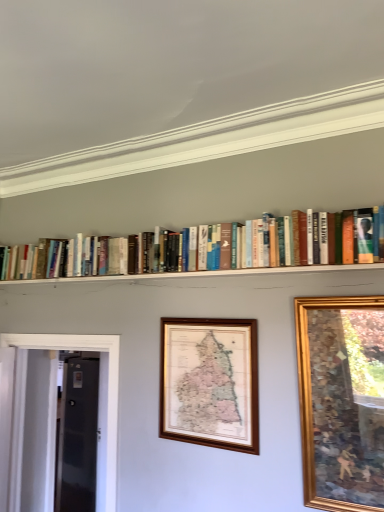
Where is `wooden map at center, the 2th picture frame in the right-to-left sequence`? wooden map at center, the 2th picture frame in the right-to-left sequence is located at coordinates (210, 382).

At what (x,y) coordinates should I click in order to perform the action: click on hardcover books at upper center. Please return your answer as a coordinate pair (x, y). This screenshot has width=384, height=512. Looking at the image, I should click on (269, 253).

Who is taller, transparent glass door at left or hardcover books at upper center?

With more height is transparent glass door at left.

From the image's perspective, which one is positioned lower, transparent glass door at left or hardcover books at upper center?

transparent glass door at left is shown below in the image.

Considering the positions of objects transparent glass door at left and hardcover books at upper center in the image provided, who is behind, transparent glass door at left or hardcover books at upper center?

transparent glass door at left.

You are a GUI agent. You are given a task and a screenshot of the screen. Output one action in this format:
    pyautogui.click(x=<x>, y=<y>)
    Task: Click on the picture frame that is on the left side of gold wooden picture frame at upper right, the 1th picture frame positioned from the right
    The image size is (384, 512).
    Given the screenshot: What is the action you would take?
    pyautogui.click(x=210, y=382)

Can you confirm if gold wooden picture frame at upper right, which is the first picture frame in front-to-back order, is positioned to the left of wooden map at center, marked as the 1th picture frame in a back-to-front arrangement?

In fact, gold wooden picture frame at upper right, which is the first picture frame in front-to-back order, is to the right of wooden map at center, marked as the 1th picture frame in a back-to-front arrangement.

Is the surface of gold wooden picture frame at upper right, the 1th picture frame positioned from the right, in direct contact with wooden map at center, which is the 2th picture frame from front to back?

No, gold wooden picture frame at upper right, the 1th picture frame positioned from the right, is not next to wooden map at center, which is the 2th picture frame from front to back.

From the picture: Considering the relative positions of gold wooden picture frame at upper right, which is the first picture frame in front-to-back order, and wooden map at center, which is the 1th picture frame in left-to-right order, in the image provided, is gold wooden picture frame at upper right, which is the first picture frame in front-to-back order, behind wooden map at center, which is the 1th picture frame in left-to-right order,?

That is False.

From the image's perspective, which is below, wooden map at center, which is the 2th picture frame from front to back, or gold wooden picture frame at upper right, marked as the 2th picture frame in a back-to-front arrangement?

wooden map at center, which is the 2th picture frame from front to back, appears lower in the image.

Does wooden map at center, the 2th picture frame in the right-to-left sequence, come in front of gold wooden picture frame at upper right, the 1th picture frame positioned from the right?

No, it is behind gold wooden picture frame at upper right, the 1th picture frame positioned from the right.

Is hardcover books at upper center touching gold wooden picture frame at upper right, the 1th picture frame positioned from the right?

hardcover books at upper center and gold wooden picture frame at upper right, the 1th picture frame positioned from the right, are clearly separated.

In the scene shown: Does hardcover books at upper center have a lesser width compared to gold wooden picture frame at upper right, which ranks as the 2th picture frame in left-to-right order?

No, hardcover books at upper center is not thinner than gold wooden picture frame at upper right, which ranks as the 2th picture frame in left-to-right order.

Which object is further away from the camera, hardcover books at upper center or gold wooden picture frame at upper right, which is the first picture frame in front-to-back order?

hardcover books at upper center is more distant.

Can you confirm if hardcover books at upper center is shorter than gold wooden picture frame at upper right, marked as the 2th picture frame in a back-to-front arrangement?

Correct, hardcover books at upper center is not as tall as gold wooden picture frame at upper right, marked as the 2th picture frame in a back-to-front arrangement.

Considering the sizes of objects hardcover books at upper center and transparent glass door at left in the image provided, who is thinner, hardcover books at upper center or transparent glass door at left?

transparent glass door at left is thinner.

Measure the distance from hardcover books at upper center to transparent glass door at left.

hardcover books at upper center is 7.33 feet away from transparent glass door at left.

What's the angular difference between hardcover books at upper center and transparent glass door at left's facing directions?

The angle between the facing direction of hardcover books at upper center and the facing direction of transparent glass door at left is 0.089 degrees.

From a real-world perspective, is hardcover books at upper center physically above transparent glass door at left?

Yes, from a real-world perspective, hardcover books at upper center is over transparent glass door at left

From the image's perspective, is transparent glass door at left positioned above or below wooden map at center, which is the 1th picture frame in left-to-right order?

transparent glass door at left is below wooden map at center, which is the 1th picture frame in left-to-right order.

Considering the sizes of objects transparent glass door at left and wooden map at center, which is the 2th picture frame from front to back, in the image provided, who is bigger, transparent glass door at left or wooden map at center, which is the 2th picture frame from front to back,?

transparent glass door at left is bigger.

Which object is further away from the camera, transparent glass door at left or wooden map at center, marked as the 1th picture frame in a back-to-front arrangement?

Positioned behind is transparent glass door at left.

From a real-world perspective, between transparent glass door at left and wooden map at center, which is the 2th picture frame from front to back, who is vertically lower?

transparent glass door at left.

From a real-world perspective, which is physically above, gold wooden picture frame at upper right, which ranks as the 2th picture frame in left-to-right order, or hardcover books at upper center?

hardcover books at upper center, from a real-world perspective.

Is gold wooden picture frame at upper right, the 1th picture frame positioned from the right, positioned with its back to hardcover books at upper center?

gold wooden picture frame at upper right, the 1th picture frame positioned from the right, does not have its back to hardcover books at upper center.

Can you confirm if gold wooden picture frame at upper right, which ranks as the 2th picture frame in left-to-right order, is taller than hardcover books at upper center?

Correct, gold wooden picture frame at upper right, which ranks as the 2th picture frame in left-to-right order, is much taller as hardcover books at upper center.

From the image's perspective, is gold wooden picture frame at upper right, marked as the 2th picture frame in a back-to-front arrangement, over hardcover books at upper center?

No, from the image's perspective, gold wooden picture frame at upper right, marked as the 2th picture frame in a back-to-front arrangement, is not above hardcover books at upper center.

In the image, there is a transparent glass door at left. In order to click on book above it (from the image's perspective) in this screenshot , I will do `click(269, 253)`.

The image size is (384, 512). I want to click on picture frame positioned vertically above the gold wooden picture frame at upper right, the 1th picture frame positioned from the right (from a real-world perspective), so click(210, 382).

Based on their spatial positions, is transparent glass door at left or hardcover books at upper center further from wooden map at center, marked as the 1th picture frame in a back-to-front arrangement?

transparent glass door at left lies further to wooden map at center, marked as the 1th picture frame in a back-to-front arrangement, than the other object.

From the image, which object appears to be nearer to hardcover books at upper center, transparent glass door at left or wooden map at center, which is the 1th picture frame in left-to-right order?

Among the two, wooden map at center, which is the 1th picture frame in left-to-right order, is located nearer to hardcover books at upper center.

Which object lies further to the anchor point transparent glass door at left, hardcover books at upper center or gold wooden picture frame at upper right, which is the first picture frame in front-to-back order?

gold wooden picture frame at upper right, which is the first picture frame in front-to-back order.

Considering their positions, is hardcover books at upper center positioned closer to gold wooden picture frame at upper right, which ranks as the 2th picture frame in left-to-right order, than transparent glass door at left?

hardcover books at upper center is positioned closer to the anchor gold wooden picture frame at upper right, which ranks as the 2th picture frame in left-to-right order.

Looking at the image, which one is located closer to wooden map at center, which is the 2th picture frame from front to back, hardcover books at upper center or transparent glass door at left?

Based on the image, hardcover books at upper center appears to be nearer to wooden map at center, which is the 2th picture frame from front to back.

Based on the photo, estimate the real-world distances between objects in this image. Which object is closer to gold wooden picture frame at upper right, which ranks as the 2th picture frame in left-to-right order, transparent glass door at left or wooden map at center, marked as the 1th picture frame in a back-to-front arrangement?

Based on the image, wooden map at center, marked as the 1th picture frame in a back-to-front arrangement, appears to be nearer to gold wooden picture frame at upper right, which ranks as the 2th picture frame in left-to-right order.

Estimate the real-world distances between objects in this image. Which object is further from hardcover books at upper center, transparent glass door at left or gold wooden picture frame at upper right, which ranks as the 2th picture frame in left-to-right order?

transparent glass door at left is further to hardcover books at upper center.

Consider the image. From the image, which object appears to be nearer to transparent glass door at left, gold wooden picture frame at upper right, which ranks as the 2th picture frame in left-to-right order, or hardcover books at upper center?

Among the two, hardcover books at upper center is located nearer to transparent glass door at left.

Locate an element on the screen. Image resolution: width=384 pixels, height=512 pixels. picture frame positioned between hardcover books at upper center and transparent glass door at left from near to far is located at coordinates (210, 382).

This screenshot has height=512, width=384. I want to click on picture frame located between gold wooden picture frame at upper right, the 1th picture frame positioned from the right, and transparent glass door at left in the depth direction, so tap(210, 382).

The width and height of the screenshot is (384, 512). In order to click on book located between gold wooden picture frame at upper right, which is the first picture frame in front-to-back order, and transparent glass door at left in the depth direction in this screenshot , I will do `click(269, 253)`.

Find the location of a particular element. Image resolution: width=384 pixels, height=512 pixels. picture frame situated between hardcover books at upper center and gold wooden picture frame at upper right, marked as the 2th picture frame in a back-to-front arrangement, from left to right is located at coordinates (210, 382).